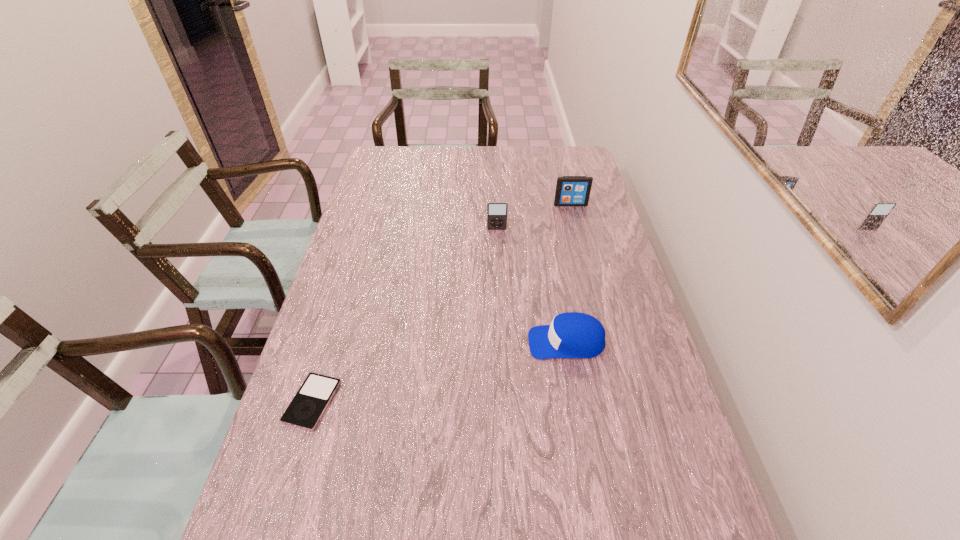
Find the location of a particular element. This screenshot has width=960, height=540. vacant space located 0.230m on the front-facing side of the third farthest object is located at coordinates tap(441, 342).

Locate an element on the screen. This screenshot has width=960, height=540. vacant region located 0.340m on the front-facing side of the third farthest object is located at coordinates (399, 342).

The image size is (960, 540). I want to click on vacant space located on the front-facing side of the third farthest object, so click(441, 342).

In order to click on free spot located 0.160m on the back of the leftmost iPod in this screenshot , I will do `click(336, 325)`.

The height and width of the screenshot is (540, 960). In order to click on object that is at the left edge in this screenshot , I will do `click(310, 402)`.

I want to click on iPod located at the right edge, so click(x=570, y=190).

The height and width of the screenshot is (540, 960). I want to click on baseball cap that is at the right edge, so click(577, 335).

Where is `vacant space at the far edge of the desktop`? This screenshot has width=960, height=540. vacant space at the far edge of the desktop is located at coordinates (493, 150).

You are a GUI agent. You are given a task and a screenshot of the screen. Output one action in this format:
    pyautogui.click(x=<x>, y=<y>)
    Task: Click on the vacant space at the left edge of the desktop
    The width and height of the screenshot is (960, 540).
    Given the screenshot: What is the action you would take?
    pyautogui.click(x=333, y=309)

At what (x,y) coordinates should I click in order to perform the action: click on free spot at the right edge of the desktop. Please return your answer as a coordinate pair (x, y). Looking at the image, I should click on (601, 237).